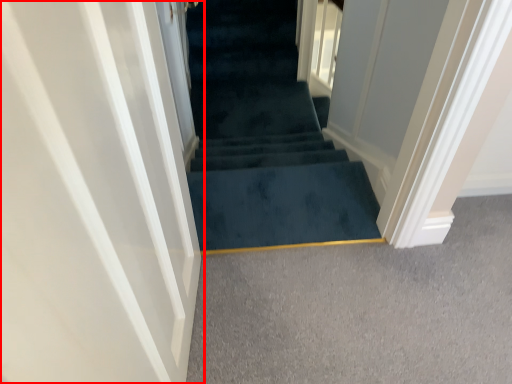
Question: From the image's perspective, considering the relative positions of door (annotated by the red box) and stairs in the image provided, where is door (annotated by the red box) located with respect to the staircase?

Choices:
 (A) above
 (B) below

Answer: (B)